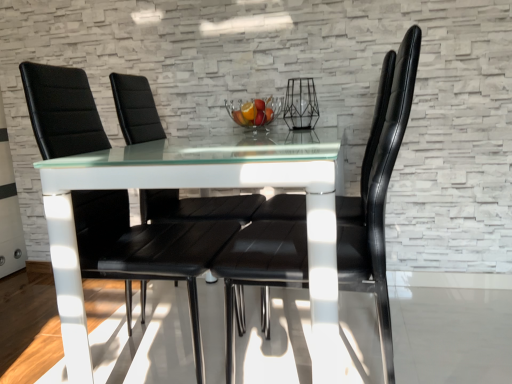
Measure the distance between point (292,249) and camera.

Point (292,249) and camera are 5.47 feet apart.

What do you see at coordinates (254, 112) in the screenshot? This screenshot has width=512, height=384. I see `clear glass bowl at center` at bounding box center [254, 112].

The width and height of the screenshot is (512, 384). I want to click on black leather chair at center, placed as the second chair when sorted from back to front, so click(145, 250).

Is black leather chair at center, which is counted as the first chair, starting from the back, closer to the viewer compared to black leather chair at center, which ranks as the 3th chair in back-to-front order?

No, the depth of black leather chair at center, which is counted as the first chair, starting from the back, is greater than that of black leather chair at center, which ranks as the 3th chair in back-to-front order.

Is black leather chair at center, marked as the 3th chair in a front-to-back arrangement, thinner than black leather chair at center, which is the 1th chair in front-to-back order?

Correct, the width of black leather chair at center, marked as the 3th chair in a front-to-back arrangement, is less than that of black leather chair at center, which is the 1th chair in front-to-back order.

Which of these two, black leather chair at center, marked as the 3th chair in a front-to-back arrangement, or black leather chair at center, which is the 1th chair in front-to-back order, stands taller?

With more height is black leather chair at center, which is the 1th chair in front-to-back order.

Does black leather chair at center, which is counted as the first chair, starting from the back, have a smaller size compared to black leather chair at center, which is the 1th chair in front-to-back order?

Correct, black leather chair at center, which is counted as the first chair, starting from the back, occupies less space than black leather chair at center, which is the 1th chair in front-to-back order.

Between black leather chair at center, marked as the 3th chair in a front-to-back arrangement, and clear glass bowl at center, which one has smaller size?

With smaller size is clear glass bowl at center.

Does black leather chair at center, which is counted as the first chair, starting from the back, have a lesser width compared to clear glass bowl at center?

Incorrect, the width of black leather chair at center, which is counted as the first chair, starting from the back, is not less than that of clear glass bowl at center.

From the picture: Is black leather chair at center, marked as the 3th chair in a front-to-back arrangement, located outside clear glass bowl at center?

Absolutely, black leather chair at center, marked as the 3th chair in a front-to-back arrangement, is external to clear glass bowl at center.

Is clear glass bowl at center turned away from black leather chair at center, marked as the 3th chair in a front-to-back arrangement?

Yes, clear glass bowl at center's orientation is away from black leather chair at center, marked as the 3th chair in a front-to-back arrangement.

Looking at this image, can you confirm if clear glass bowl at center is taller than black leather chair at center, which is counted as the first chair, starting from the back?

No.

Is clear glass bowl at center touching black leather chair at center, which is counted as the first chair, starting from the back?

No, clear glass bowl at center is not touching black leather chair at center, which is counted as the first chair, starting from the back.

Which is correct: clear glass bowl at center is inside black leather chair at center, marked as the 3th chair in a front-to-back arrangement, or outside of it?

clear glass bowl at center is located inside black leather chair at center, marked as the 3th chair in a front-to-back arrangement.

Is point (282, 271) farther from viewer compared to point (127, 142)?

No, (282, 271) is in front of (127, 142).

Would you consider black leather chair at center, which is the 1th chair in front-to-back order, to be distant from black leather chair at center, marked as the 3th chair in a front-to-back arrangement?

No, black leather chair at center, which is the 1th chair in front-to-back order, is not far away from black leather chair at center, marked as the 3th chair in a front-to-back arrangement.

Is black leather chair at center, which ranks as the 3th chair in back-to-front order, positioned with its back to black leather chair at center, which is counted as the first chair, starting from the back?

No.

Between black leather chair at center, which ranks as the 3th chair in back-to-front order, and black leather chair at center, which is counted as the first chair, starting from the back, which one is positioned in front?

black leather chair at center, which ranks as the 3th chair in back-to-front order.

Is black leather chair at center, the second chair when ordered from front to back, positioned far away from black leather chair at center, marked as the 3th chair in a front-to-back arrangement?

No, black leather chair at center, the second chair when ordered from front to back, is not far from black leather chair at center, marked as the 3th chair in a front-to-back arrangement.

This screenshot has width=512, height=384. There is a black leather chair at center, the second chair when ordered from front to back. In order to click on the 2nd chair above it (from the image's perspective) in this screenshot , I will do `click(196, 207)`.

Can you confirm if black leather chair at center, placed as the second chair when sorted from back to front, is positioned to the right of black leather chair at center, which is counted as the first chair, starting from the back?

Incorrect, black leather chair at center, placed as the second chair when sorted from back to front, is not on the right side of black leather chair at center, which is counted as the first chair, starting from the back.

How different are the orientations of black leather chair at center, placed as the second chair when sorted from back to front, and black leather chair at center, marked as the 3th chair in a front-to-back arrangement, in degrees?

The angle between the facing direction of black leather chair at center, placed as the second chair when sorted from back to front, and the facing direction of black leather chair at center, marked as the 3th chair in a front-to-back arrangement, is 1.46 degrees.

Find the location of `the 2nd chair to the left when counting from the clear glass bowl at center`. the 2nd chair to the left when counting from the clear glass bowl at center is located at coordinates (145, 250).

Can you confirm if clear glass bowl at center is taller than black leather chair at center, the second chair when ordered from front to back?

In fact, clear glass bowl at center may be shorter than black leather chair at center, the second chair when ordered from front to back.

Which is in front, point (248, 112) or point (59, 157)?

Point (59, 157)

Is clear glass bowl at center positioned far away from black leather chair at center, placed as the second chair when sorted from back to front?

No, clear glass bowl at center is in close proximity to black leather chair at center, placed as the second chair when sorted from back to front.

Considering the points (287, 280) and (274, 109), which point is in front, point (287, 280) or point (274, 109)?

The point (287, 280) is closer.

Between black leather chair at center, which ranks as the 3th chair in back-to-front order, and clear glass bowl at center, which one appears on the right side from the viewer's perspective?

From the viewer's perspective, black leather chair at center, which ranks as the 3th chair in back-to-front order, appears more on the right side.

Could you tell me if black leather chair at center, which is the 1th chair in front-to-back order, is facing clear glass bowl at center?

No, black leather chair at center, which is the 1th chair in front-to-back order, does not turn towards clear glass bowl at center.

Is black leather chair at center, which is the 1th chair in front-to-back order, positioned in front of clear glass bowl at center?

Yes, it is in front of clear glass bowl at center.

Where is `the 2nd chair positioned below the black leather chair at center, which is the 1th chair in front-to-back order (from a real-world perspective)`? This screenshot has width=512, height=384. the 2nd chair positioned below the black leather chair at center, which is the 1th chair in front-to-back order (from a real-world perspective) is located at coordinates (196, 207).

The height and width of the screenshot is (384, 512). Identify the location of glass bowl that appears above the black leather chair at center, which is counted as the first chair, starting from the back (from the image's perspective). [254, 112].

Which object lies nearer to the anchor point black leather chair at center, which is counted as the first chair, starting from the back, black leather chair at center, the second chair when ordered from front to back, or clear glass bowl at center?

The object closer to black leather chair at center, which is counted as the first chair, starting from the back, is black leather chair at center, the second chair when ordered from front to back.

When comparing their distances from clear glass bowl at center, does black leather chair at center, which ranks as the 3th chair in back-to-front order, or black leather chair at center, placed as the second chair when sorted from back to front, seem further?

black leather chair at center, which ranks as the 3th chair in back-to-front order, is further to clear glass bowl at center.

Based on their spatial positions, is black leather chair at center, the second chair when ordered from front to back, or black leather chair at center, which ranks as the 3th chair in back-to-front order, closer to black leather chair at center, marked as the 3th chair in a front-to-back arrangement?

black leather chair at center, the second chair when ordered from front to back.

From the image, which object appears to be farther from black leather chair at center, which is counted as the first chair, starting from the back, black leather chair at center, which ranks as the 3th chair in back-to-front order, or black leather chair at center, placed as the second chair when sorted from back to front?

The object further to black leather chair at center, which is counted as the first chair, starting from the back, is black leather chair at center, which ranks as the 3th chair in back-to-front order.

Which object lies nearer to the anchor point clear glass bowl at center, black leather chair at center, marked as the 3th chair in a front-to-back arrangement, or black leather chair at center, which ranks as the 3th chair in back-to-front order?

Among the two, black leather chair at center, marked as the 3th chair in a front-to-back arrangement, is located nearer to clear glass bowl at center.

When comparing their distances from black leather chair at center, placed as the second chair when sorted from back to front, does clear glass bowl at center or black leather chair at center, which is counted as the first chair, starting from the back, seem further?

clear glass bowl at center is positioned further to the anchor black leather chair at center, placed as the second chair when sorted from back to front.

Which object lies further to the anchor point black leather chair at center, the second chair when ordered from front to back, black leather chair at center, which is the 1th chair in front-to-back order, or clear glass bowl at center?

clear glass bowl at center.

Which object lies nearer to the anchor point black leather chair at center, marked as the 3th chair in a front-to-back arrangement, black leather chair at center, which is the 1th chair in front-to-back order, or clear glass bowl at center?

Among the two, black leather chair at center, which is the 1th chair in front-to-back order, is located nearer to black leather chair at center, marked as the 3th chair in a front-to-back arrangement.

Locate an element on the screen. Image resolution: width=512 pixels, height=384 pixels. chair between black leather chair at center, which ranks as the 3th chair in back-to-front order, and black leather chair at center, marked as the 3th chair in a front-to-back arrangement, from front to back is located at coordinates (145, 250).

Identify the location of chair positioned between black leather chair at center, the second chair when ordered from front to back, and clear glass bowl at center from near to far. Image resolution: width=512 pixels, height=384 pixels. (196, 207).